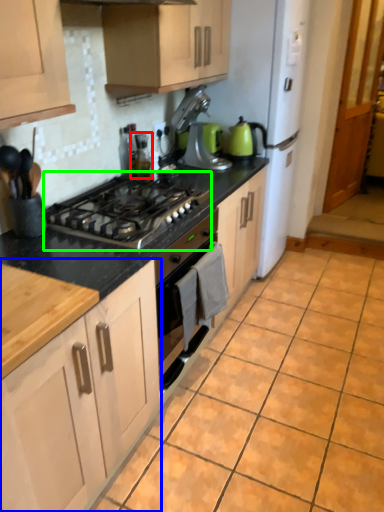
Question: Which is nearer to the appliance (highlighted by a red box)? cabinetry (highlighted by a blue box) or gas stove (highlighted by a green box).

Choices:
 (A) cabinetry
 (B) gas stove

Answer: (B)